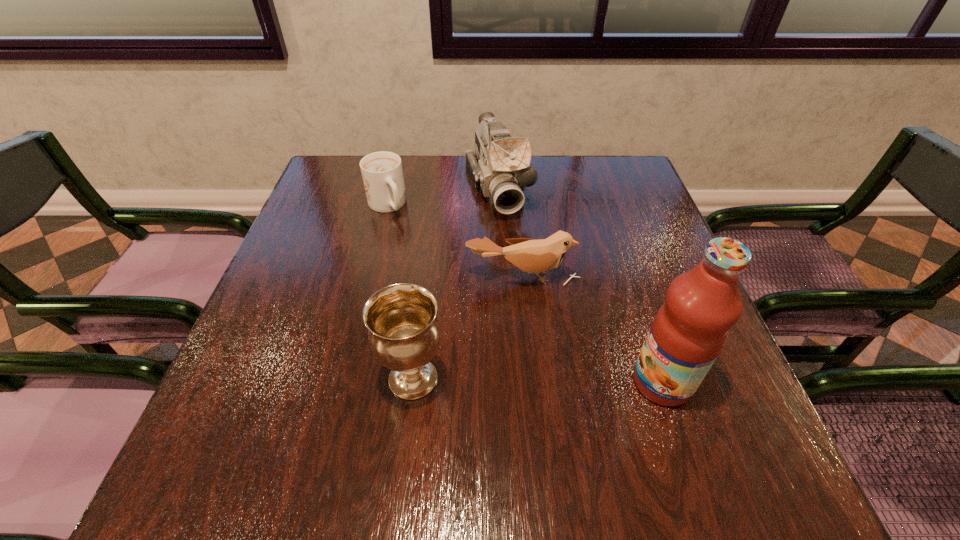
Identify the location of free spot at the right edge of the desktop. The height and width of the screenshot is (540, 960). (639, 234).

In the image, there is a desktop. Where is `vacant space at the far left corner`? This screenshot has width=960, height=540. vacant space at the far left corner is located at coordinates (330, 156).

In the image, there is a desktop. At what (x,y) coordinates should I click in order to perform the action: click on vacant space at the near left corner. Please return your answer as a coordinate pair (x, y). This screenshot has width=960, height=540. Looking at the image, I should click on (241, 402).

In the image, there is a desktop. Where is `free region at the far right corner`? This screenshot has height=540, width=960. free region at the far right corner is located at coordinates (619, 157).

The width and height of the screenshot is (960, 540). What are the coordinates of `free space between the bird and the cappuccino` in the screenshot? It's located at (454, 241).

Find the location of `free point between the fruit juice and the camcorder`. free point between the fruit juice and the camcorder is located at coordinates (580, 285).

Locate an element on the screen. Image resolution: width=960 pixels, height=540 pixels. free space between the bird and the camcorder is located at coordinates pyautogui.click(x=510, y=232).

You are a GUI agent. You are given a task and a screenshot of the screen. Output one action in this format:
    pyautogui.click(x=<x>, y=<y>)
    Task: Click on the free space between the fruit juice and the camcorder
    Image resolution: width=960 pixels, height=540 pixels.
    Given the screenshot: What is the action you would take?
    pyautogui.click(x=580, y=285)

Where is `unoccupied area between the bird and the cappuccino`? Image resolution: width=960 pixels, height=540 pixels. unoccupied area between the bird and the cappuccino is located at coordinates (454, 241).

The height and width of the screenshot is (540, 960). I want to click on vacant space in between the bird and the fruit juice, so click(592, 329).